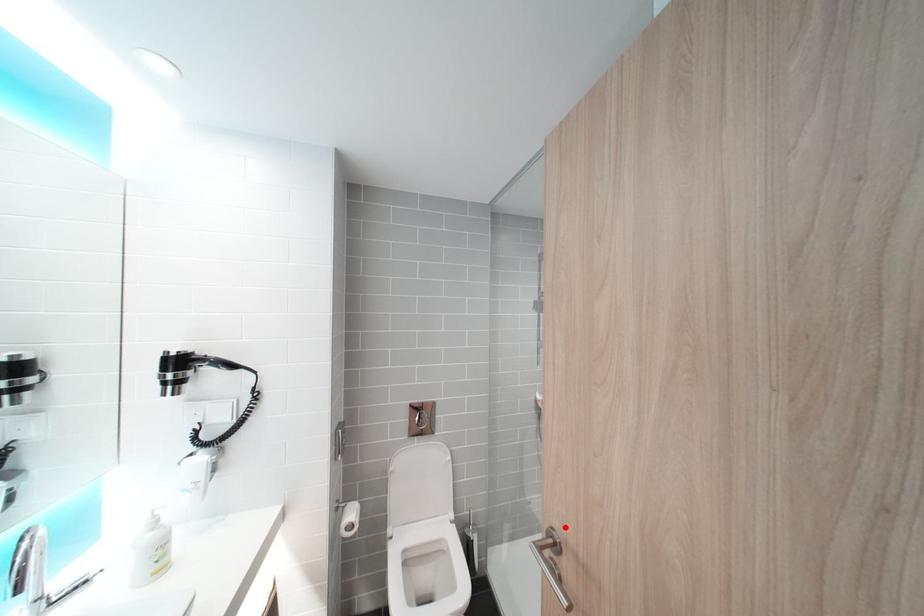
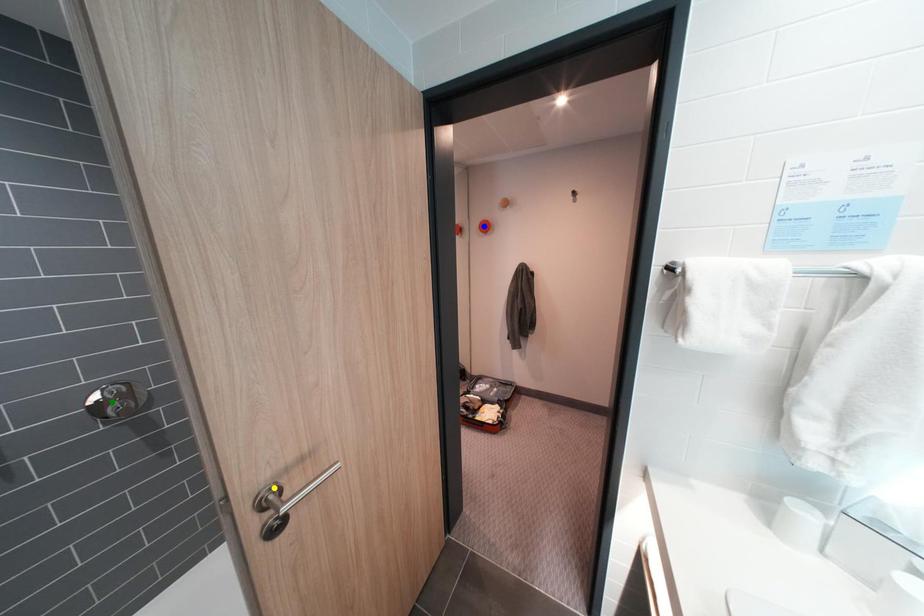
Question: I am providing you with two images of the same scene from different viewpoints. A red point is marked on the first image. You are given multiple points on the second image. Which point in image 2 is actually the same real-world point as the red point in image 1?

Choices:
 (A) yellow point
 (B) blue point
 (C) green point

Answer: (A)